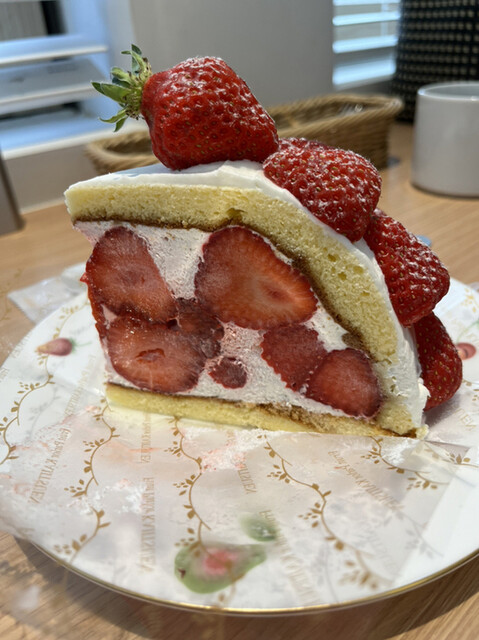
The image size is (479, 640). I want to click on blinds, so click(x=365, y=45), click(x=371, y=17), click(x=362, y=4).